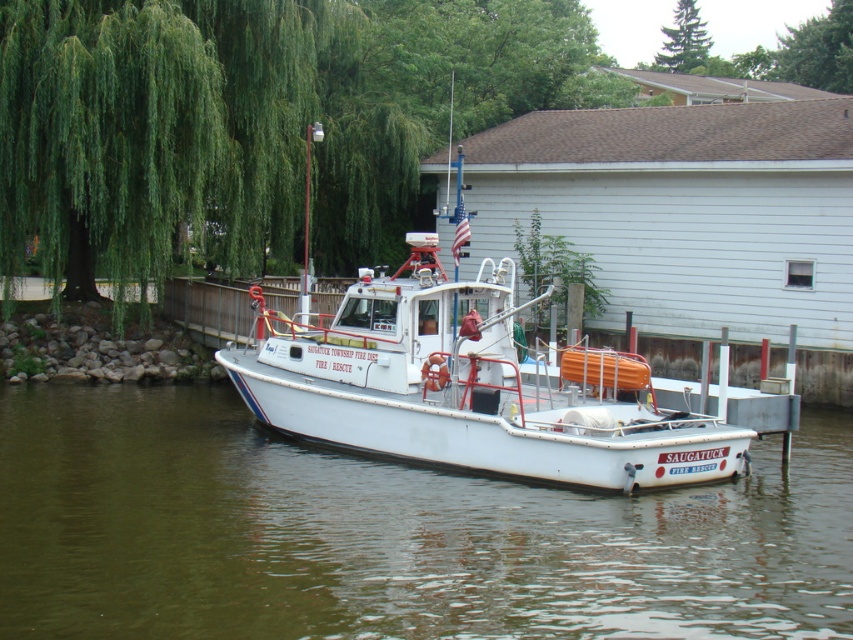
You are a drone operator tasked with capturing aerial footage of the fire rescue boat. You need to ensure that both points, point (x=268, y=502) and point (x=486, y=273), are visible in the frame. Since you want to focus on the closer point first, which point should you prioritize positioning the drone camera to capture first?

Point (x=268, y=502) is closer to the viewer than point (x=486, y=273), so you should prioritize positioning the drone camera to capture point (x=268, y=502) first.

You are a photographer standing at the pier, and you want to take a photo of the white matte boat at center. If your camera can focus on objects up to 15 meters away, will you be able to capture a clear image of the boat?

The white matte boat at center is 14.29 meters away from the camera, which is within the camera focus range of up to 15 meters. Therefore, the photographer can capture a clear image of the white matte boat at center.